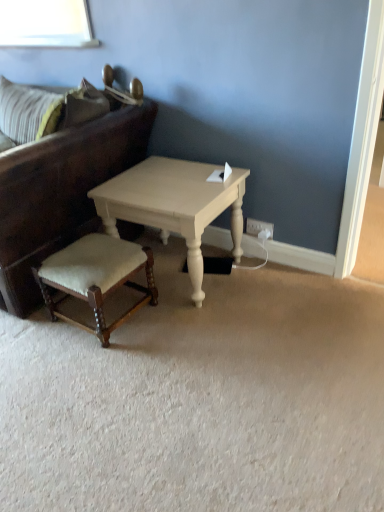
This screenshot has width=384, height=512. I want to click on free location above velvet beige stool at lower left (from a real-world perspective), so coord(92,251).